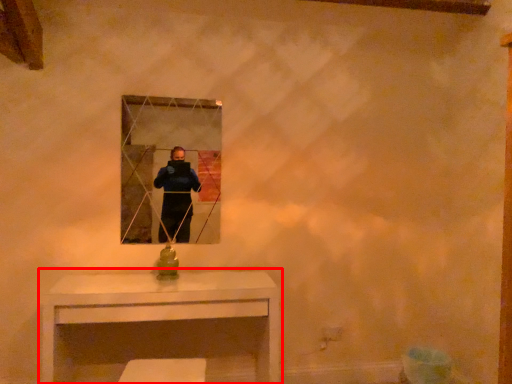
Question: From the image's perspective, where is table (annotated by the red box) located relative to mirror?

Choices:
 (A) above
 (B) below

Answer: (B)